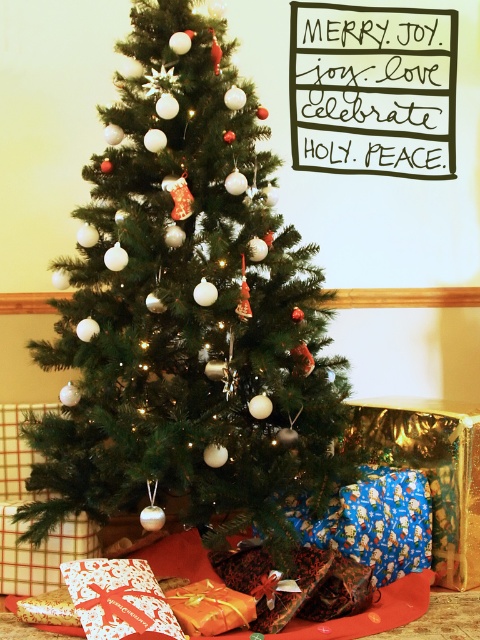
You are a guest at a Christmas party and want to pick up the shiny gold wrapping paper at lower center to wrap your gift. Can you easily reach it without moving the white glossy gift at lower center?

A: The white glossy gift at lower center is closer to the viewer than the shiny gold wrapping paper at lower center, so you cannot easily reach the shiny gold wrapping paper at lower center without moving the white glossy gift at lower center first.

You are a child looking for your gift under the green matte christmas tree at center. You see the shiny gold wrapping paper at lower center. Where would you look to find your gift?

The green matte christmas tree at center is located above the shiny gold wrapping paper at lower center, so you should look under the green matte christmas tree at center where the shiny gold wrapping paper at lower center is placed.

You are a child who just entered the room and sees the green matte christmas tree at center and the shiny gold wrapping paper at lower center. Which object is taller?

The green matte christmas tree at center is much taller than the shiny gold wrapping paper at lower center.